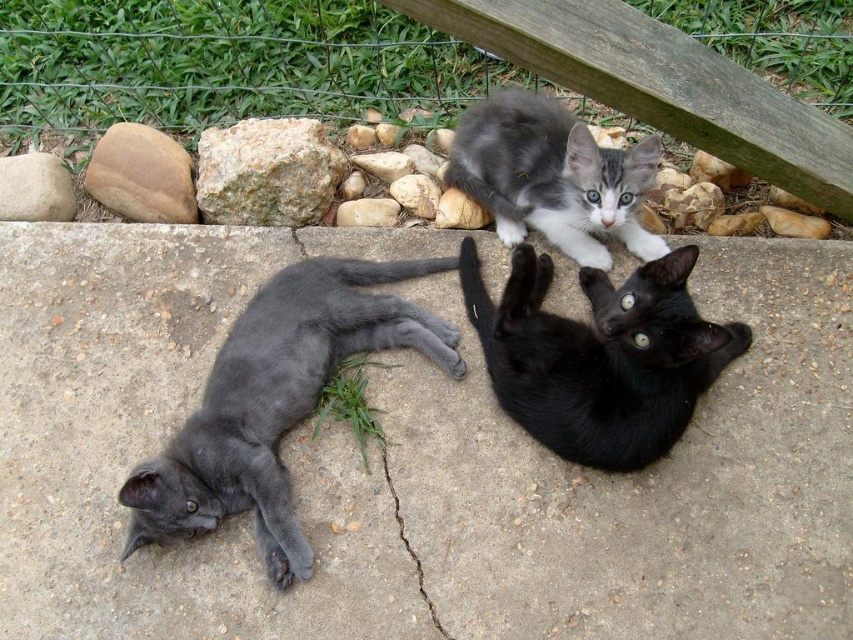
Consider the image. Is wooden at upper right smaller than speckled beige rock at upper left?

No, wooden at upper right is not smaller than speckled beige rock at upper left.

Where is `wooden at upper right`? The image size is (853, 640). wooden at upper right is located at coordinates (225, 61).

What are the coordinates of `wooden at upper right` in the screenshot? It's located at (225, 61).

Who is positioned more to the right, wooden at upper right or smooth brown rock at left?

From the viewer's perspective, wooden at upper right appears more on the right side.

Which is behind, point (113, 45) or point (129, 177)?

The point (113, 45) is behind.

I want to click on wooden at upper right, so click(x=225, y=61).

Is smooth gray cat at lower left in front of black glossy cat at center?

No.

Does smooth gray cat at lower left appear under black glossy cat at center?

Yes, smooth gray cat at lower left is below black glossy cat at center.

Between point (169, 483) and point (491, 348), which one is positioned in front?

Point (169, 483)

Find the location of a particular element. This screenshot has height=640, width=853. smooth gray cat at lower left is located at coordinates (276, 401).